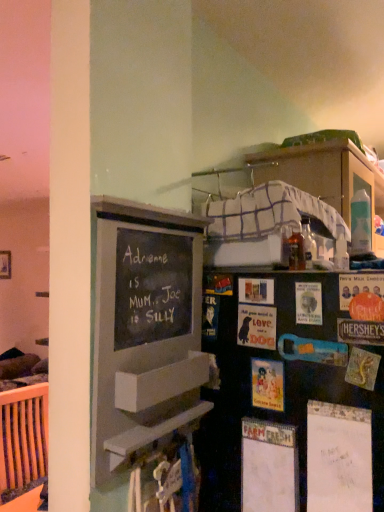
Question: Considering the positions of matte paper postcard at center, marked as the 1th postcard in a left-to-right arrangement, and chalkboard paint bulletin board at left in the image, is matte paper postcard at center, marked as the 1th postcard in a left-to-right arrangement, taller or shorter than chalkboard paint bulletin board at left?

Choices:
 (A) short
 (B) tall

Answer: (A)

Question: From a real-world perspective, is matte paper postcard at center, acting as the 4th postcard starting from the right, physically located above or below chalkboard paint bulletin board at left?

Choices:
 (A) above
 (B) below

Answer: (B)

Question: Which of these objects is positioned closest to the matte paper postcard at center, marked as the 1th postcard in a left-to-right arrangement?

Choices:
 (A) chalkboard paint bulletin board at left
 (B) matte paper postcard at center, which appears as the 3th postcard when viewed from the right
 (C) matte paper postcard at center-right, positioned as the 3th postcard in left-to-right order
 (D) black matte bookshelf at center
 (E) matte cardboard postcard at right, which is the fourth postcard from left to right

Answer: (B)

Question: Based on their relative distances, which object is farther from the black matte bookshelf at center?

Choices:
 (A) matte paper postcard at center, which appears as the 3th postcard when viewed from the right
 (B) chalkboard paint bulletin board at left
 (C) matte cardboard postcard at right, which is the fourth postcard from left to right
 (D) matte paper postcard at center-right, which appears as the second postcard when viewed from the right
 (E) matte paper postcard at center, marked as the 1th postcard in a left-to-right arrangement

Answer: (C)